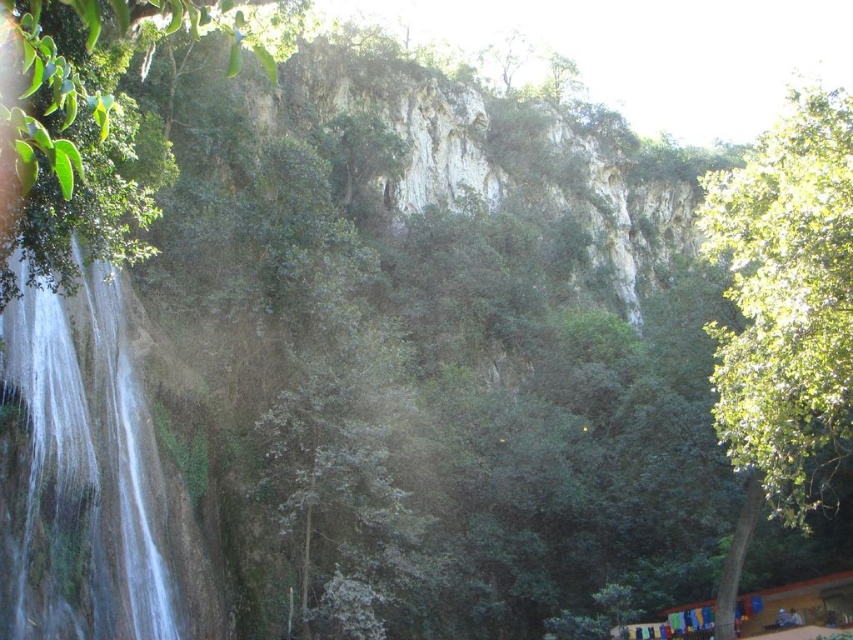
Question: Which object appears closest to the camera in this image?

Choices:
 (A) green leafy tree at left
 (B) green leafy tree at right
 (C) white smooth waterfall at left

Answer: (A)

Question: Which of the following is the closest to the observer?

Choices:
 (A) (125, 12)
 (B) (749, 173)

Answer: (A)

Question: Which object is closer to the camera taking this photo?

Choices:
 (A) green leafy tree at right
 (B) green leafy tree at left
 (C) white smooth waterfall at left

Answer: (B)

Question: Is white smooth waterfall at left positioned in front of green leafy tree at left?

Choices:
 (A) yes
 (B) no

Answer: (B)

Question: Observing the image, what is the correct spatial positioning of white smooth waterfall at left in reference to green leafy tree at left?

Choices:
 (A) left
 (B) right

Answer: (A)

Question: Considering the relative positions of white smooth waterfall at left and green leafy tree at left in the image provided, where is white smooth waterfall at left located with respect to green leafy tree at left?

Choices:
 (A) below
 (B) above

Answer: (A)